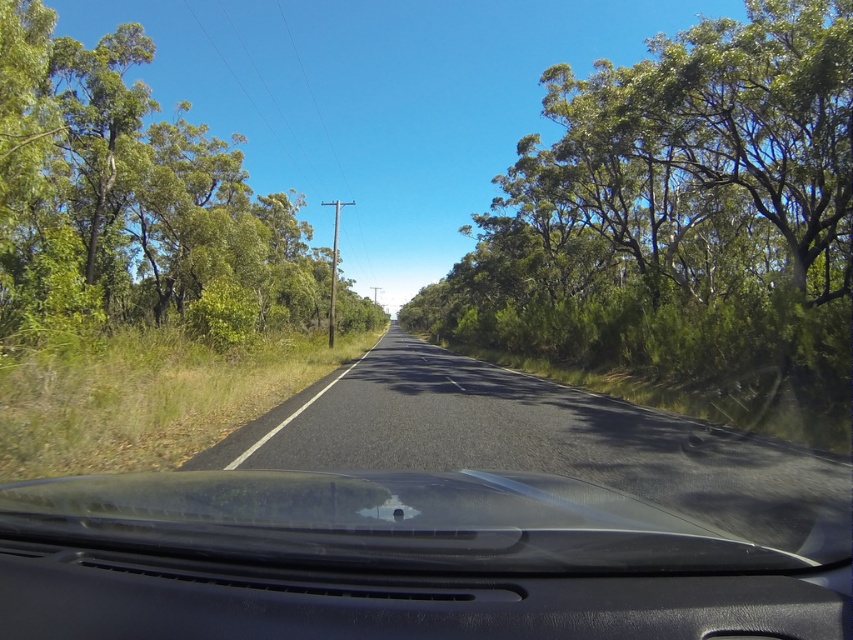
Question: In this image, where is green leafy tree at center located relative to black matte dashboard at center?

Choices:
 (A) right
 (B) left

Answer: (A)

Question: Which of these objects is positioned farthest from the green leafy tree at center?

Choices:
 (A) black matte dashboard at center
 (B) green leafy tree at left

Answer: (A)

Question: Considering the real-world distances, which object is closest to the green leafy tree at left?

Choices:
 (A) black matte dashboard at center
 (B) green leafy tree at center

Answer: (B)

Question: Is green leafy tree at left thinner than black matte dashboard at center?

Choices:
 (A) yes
 (B) no

Answer: (B)

Question: Can you confirm if green leafy tree at center is positioned to the right of green leafy tree at left?

Choices:
 (A) yes
 (B) no

Answer: (A)

Question: Estimate the real-world distances between objects in this image. Which object is closer to the green leafy tree at left?

Choices:
 (A) green leafy tree at center
 (B) black matte dashboard at center

Answer: (A)